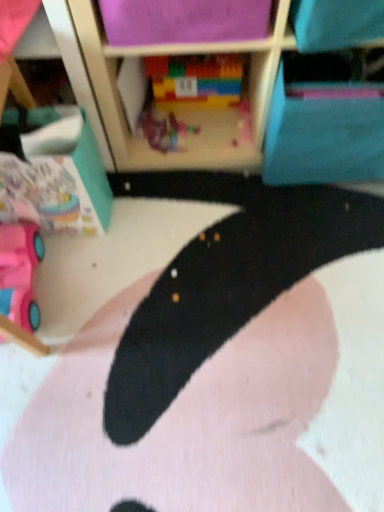
This screenshot has width=384, height=512. In order to click on free point to the right of plastic toy at center, the second toy viewed from the right in this screenshot , I will do [222, 133].